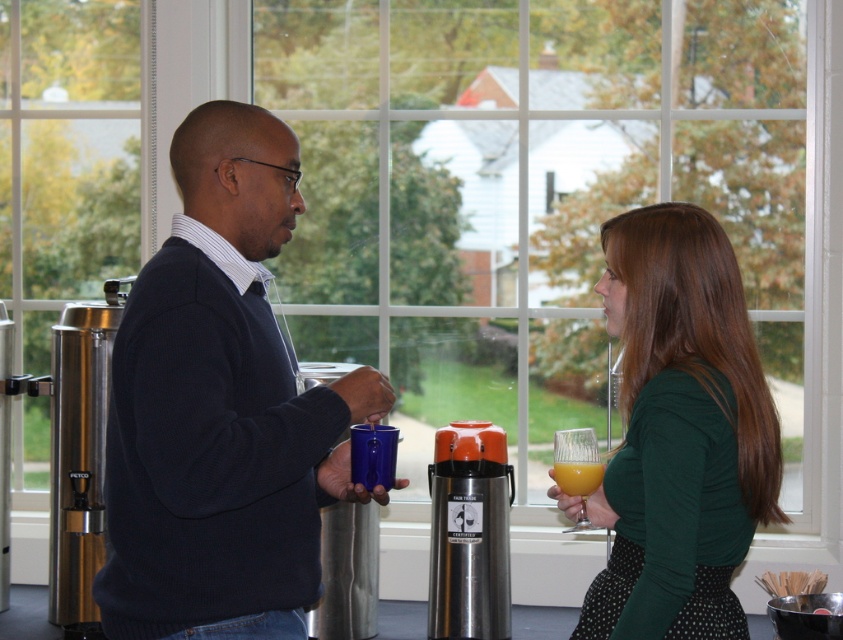
Which of these two, dark blue sweater at center or translucent glass at right, stands taller?

Standing taller between the two is dark blue sweater at center.

Who is more forward, (138, 504) or (592, 467)?

Point (138, 504) is more forward.

Who is more distant from viewer, (138, 461) or (577, 472)?

The point (577, 472) is more distant.

Where is `dark blue sweater at center`? This screenshot has width=843, height=640. dark blue sweater at center is located at coordinates click(x=221, y=408).

Is dark blue sweater at center to the left of green matte shirt at center from the viewer's perspective?

Yes, dark blue sweater at center is to the left of green matte shirt at center.

I want to click on dark blue sweater at center, so click(x=221, y=408).

Find the location of a particular element. Image resolution: width=843 pixels, height=640 pixels. dark blue sweater at center is located at coordinates (221, 408).

Which is in front, point (267, 636) or point (157, 532)?

Point (157, 532) is more forward.

Between dark blue sweater at center and matte black sweater at center, which one appears on the right side from the viewer's perspective?

From the viewer's perspective, dark blue sweater at center appears more on the right side.

Which is behind, point (253, 576) or point (305, 417)?

Point (253, 576)

The image size is (843, 640). I want to click on dark blue sweater at center, so click(x=221, y=408).